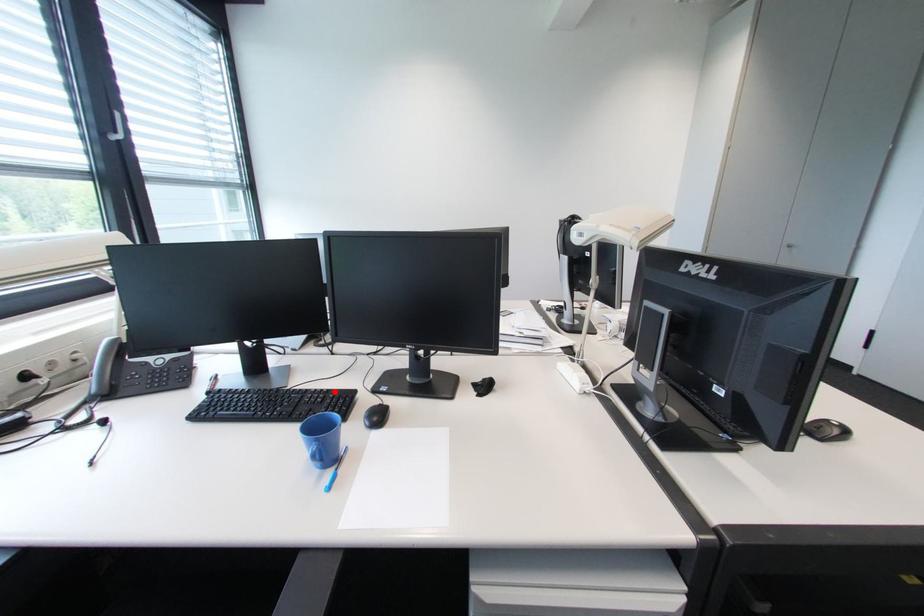
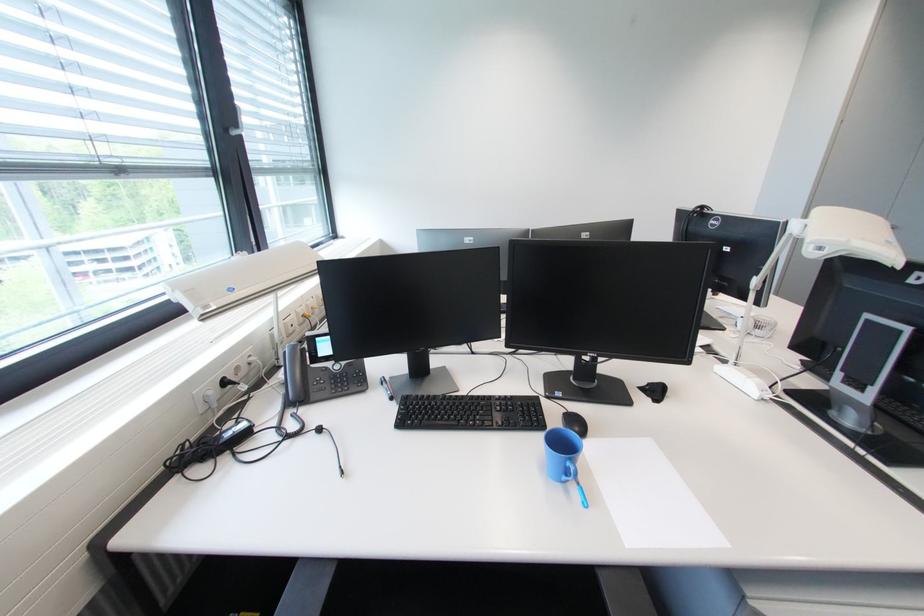
The point at the highlighted location is marked in the first image. Where is the corresponding point in the second image?

(517, 398)